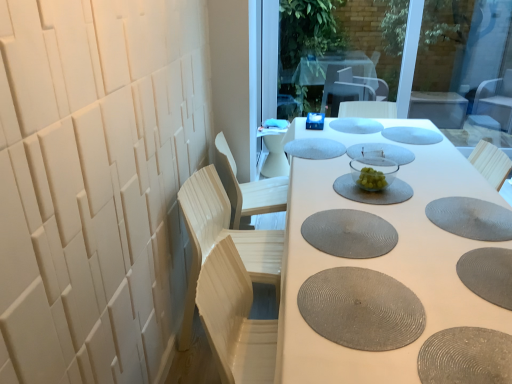
Image resolution: width=512 pixels, height=384 pixels. Identify the location of free point above gray textured placemat at lower right, which is the fifth manhole cover from front to back (from a real-world perspective). pos(475,215).